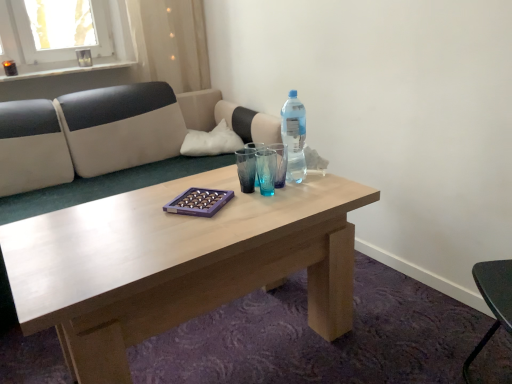
Question: Is white fabric pillow at upper center at the right side of transparent plastic bottle at center?

Choices:
 (A) no
 (B) yes

Answer: (A)

Question: Would you consider white fabric pillow at upper center to be distant from transparent plastic bottle at center?

Choices:
 (A) no
 (B) yes

Answer: (A)

Question: Is white fabric pillow at upper center further to camera compared to transparent plastic bottle at center?

Choices:
 (A) no
 (B) yes

Answer: (B)

Question: Can you confirm if white fabric pillow at upper center is wider than transparent plastic bottle at center?

Choices:
 (A) yes
 (B) no

Answer: (A)

Question: Does white fabric pillow at upper center contain transparent plastic bottle at center?

Choices:
 (A) no
 (B) yes

Answer: (A)

Question: From a real-world perspective, is transparent glass vase at upper left physically located above or below translucent plastic bottle at center?

Choices:
 (A) above
 (B) below

Answer: (A)

Question: Considering the positions of transparent glass vase at upper left and translucent plastic bottle at center in the image, is transparent glass vase at upper left taller or shorter than translucent plastic bottle at center?

Choices:
 (A) tall
 (B) short

Answer: (B)

Question: Based on their positions, is transparent glass vase at upper left located to the left or right of translucent plastic bottle at center?

Choices:
 (A) left
 (B) right

Answer: (A)

Question: Is transparent glass vase at upper left spatially inside translucent plastic bottle at center, or outside of it?

Choices:
 (A) outside
 (B) inside

Answer: (A)

Question: Does point (89, 380) appear closer or farther from the camera than point (257, 152)?

Choices:
 (A) closer
 (B) farther

Answer: (A)

Question: Looking at their shapes, would you say light brown wood coffee table at center is wider or thinner than transparent plastic bottle at center?

Choices:
 (A) thin
 (B) wide

Answer: (B)

Question: Is light brown wood coffee table at center situated inside transparent plastic bottle at center or outside?

Choices:
 (A) inside
 (B) outside

Answer: (B)

Question: Visually, is light brown wood coffee table at center positioned to the left or to the right of transparent plastic bottle at center?

Choices:
 (A) left
 (B) right

Answer: (A)

Question: Is transparent glass vase at upper left in front of or behind light brown wood coffee table at center in the image?

Choices:
 (A) front
 (B) behind

Answer: (B)

Question: In terms of size, does transparent glass vase at upper left appear bigger or smaller than light brown wood coffee table at center?

Choices:
 (A) big
 (B) small

Answer: (B)